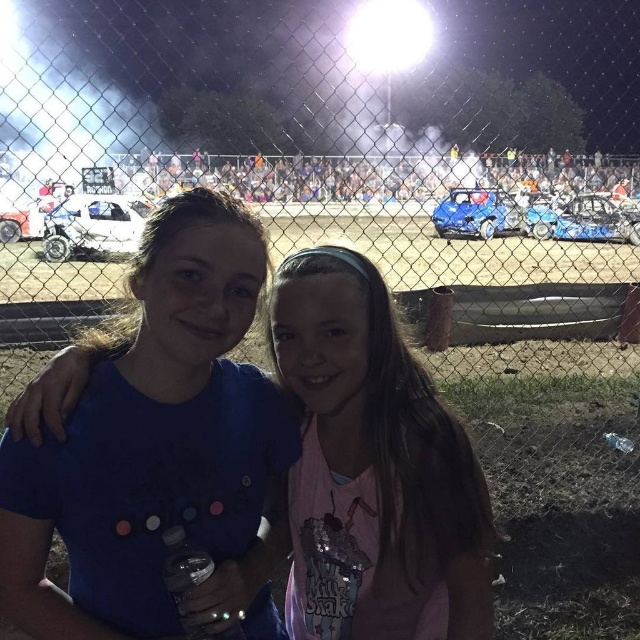
You are standing at the point marked as point (x=104, y=204) at a demolition derby event. The nearest car is 10.60 meters away from you. Can you safely walk to the nearest car without any obstacles?

The nearest car is 10.60 meters away from the point (x=104, y=204), so you can safely walk to the nearest car without any obstacles as there is enough distance.

You are a photographer at the demolition derby event. You need to capture a photo of both the white matte car at center and the matte white car at left in the same frame. Given that your camera has a fixed focal length and limited field of view, which car should you position closer to the camera to ensure both fit in the frame?

To ensure both the white matte car at center and the matte white car at left fit in the frame, position the matte white car at left closer to the camera since it is narrower than the white matte car at center. This adjustment will help both cars fit within the limited field of view.

You are a photographer at the demolition derby event and want to capture a photo of the white matte car at center. Based on its position, where should you aim your camera to ensure it is centered in the frame?

The white matte car at center is located at point 0.353 on the x axis and 0.147 on the y axis, so you should aim your camera towards those coordinates to center it in the frame.